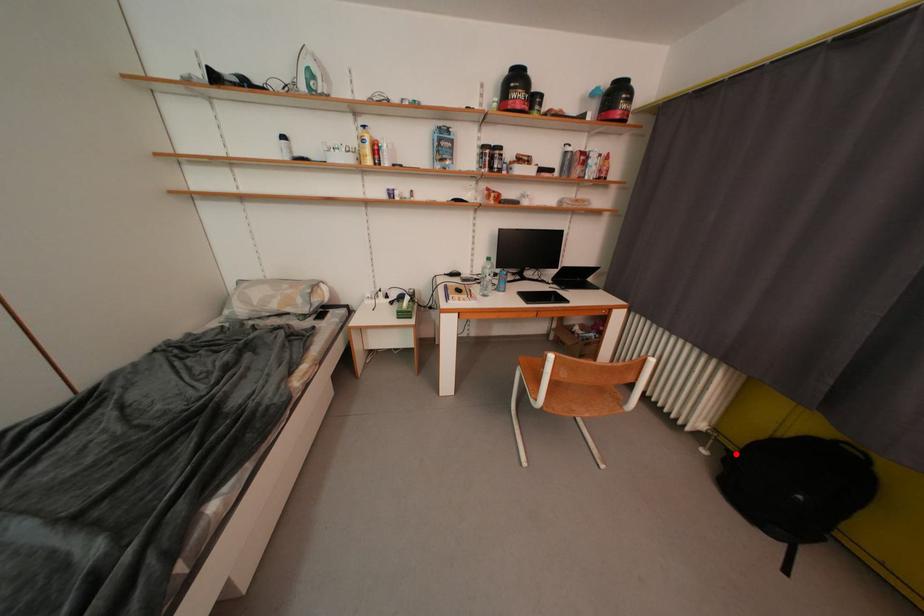
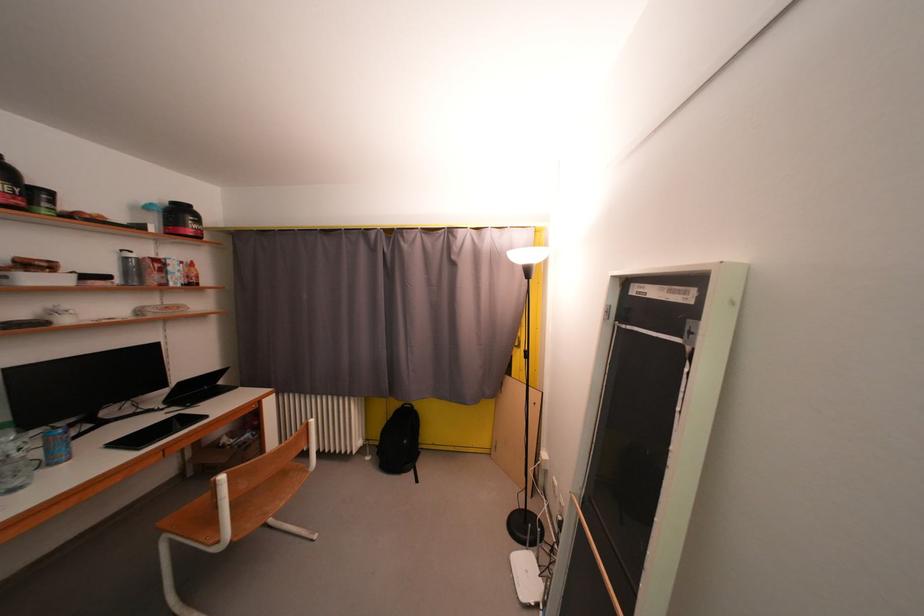
Where in the second image is the point corresponding to the highlighted location from the first image?

(384, 450)